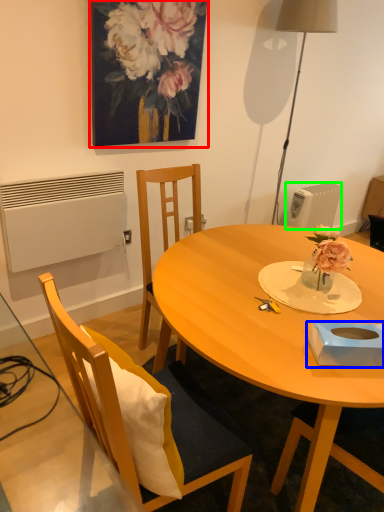
Question: Based on their relative distances, which object is nearer to picture frame (highlighted by a red box)? Choose from box (highlighted by a blue box) and radiator (highlighted by a green box).

Choices:
 (A) box
 (B) radiator

Answer: (B)